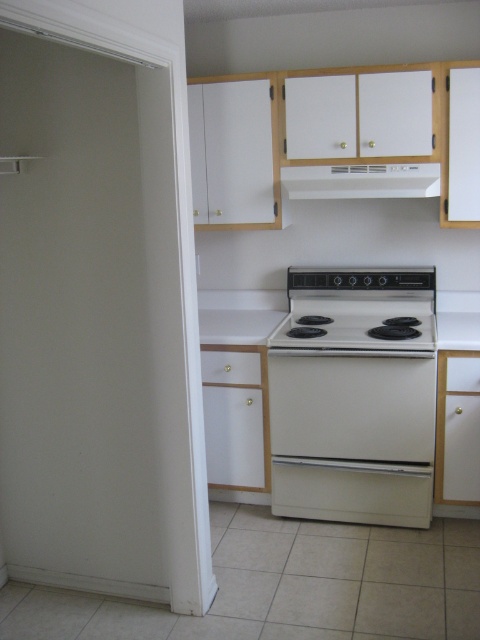
Question: Which point is closer to the camera?

Choices:
 (A) white matte exhaust hood at upper center
 (B) white glossy electric stove at center

Answer: (B)

Question: Which of these objects is positioned closest to the white glossy electric stove at center?

Choices:
 (A) white matte exhaust hood at upper center
 (B) white glossy stove at center

Answer: (B)

Question: Considering the relative positions of white glossy electric stove at center and white matte exhaust hood at upper center in the image provided, where is white glossy electric stove at center located with respect to white matte exhaust hood at upper center?

Choices:
 (A) below
 (B) above

Answer: (A)

Question: Is white glossy electric stove at center closer to camera compared to white glossy stove at center?

Choices:
 (A) no
 (B) yes

Answer: (A)

Question: Which point is farther to the camera?

Choices:
 (A) white glossy electric stove at center
 (B) white matte exhaust hood at upper center

Answer: (B)

Question: Can you confirm if white matte exhaust hood at upper center is thinner than white glossy stove at center?

Choices:
 (A) no
 (B) yes

Answer: (B)